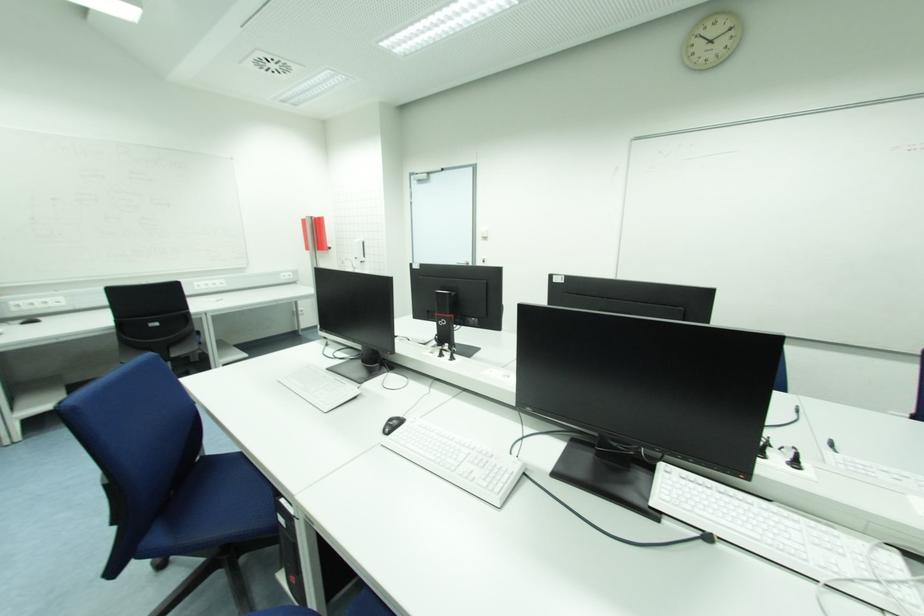
The image size is (924, 616). I want to click on blue chair sitting surface, so click(235, 499).